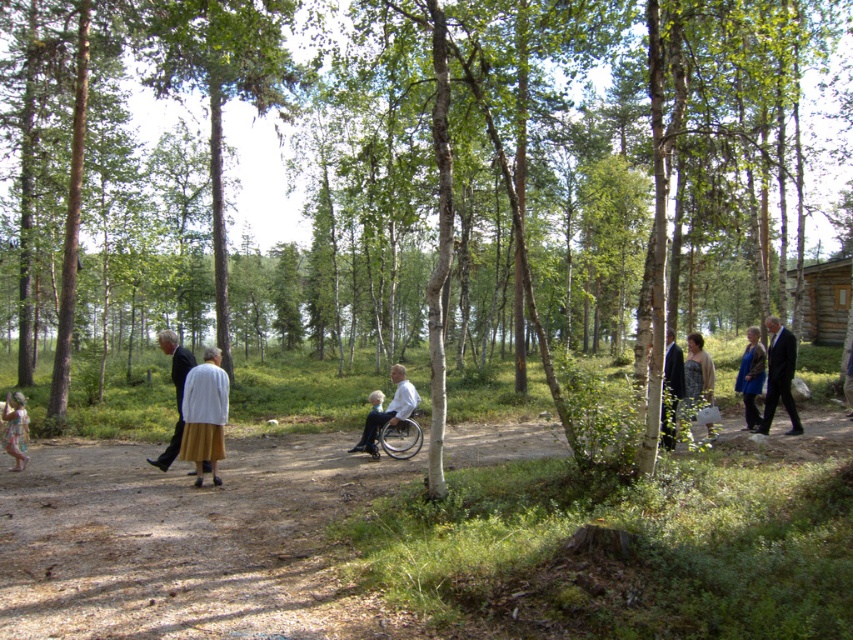
You are a hiker planning to walk along the dirt path in the forest scene. You see a white matte wheelchair at center and a dark blue suit at right. Which object is positioned lower in the image?

The white matte wheelchair at center is positioned lower than the dark blue suit at right.

You are standing at the point marked as point (779, 376) in the image. Looking around, you see a dark suit at right. What is the nearest object to your current position?

The nearest object to point (779, 376) is the dark suit at right since it is directly at that coordinate.

You are a hiker planning to walk along the dirt path in the forest. You see a white matte wheelchair at center and a dark blue suit at right. Which object is narrower in width?

The white matte wheelchair at center is narrower in width compared to the dark blue suit at right.